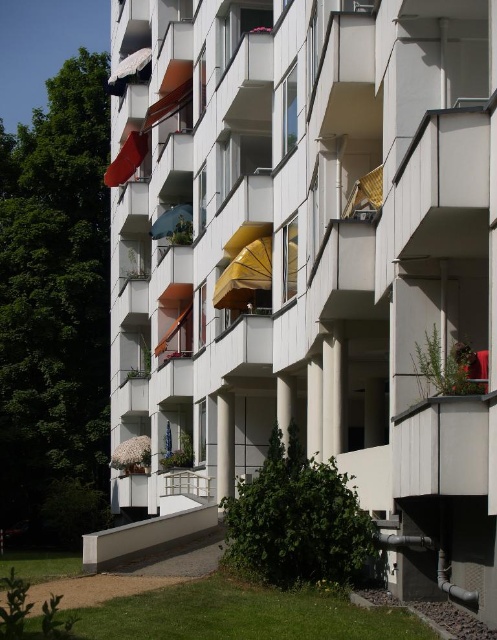
Where is `matte red umbrella at upper left`? The image size is (497, 640). matte red umbrella at upper left is located at coordinates (127, 160).

This screenshot has height=640, width=497. What are the coordinates of `matte red umbrella at upper left` in the screenshot? It's located at (127, 160).

The image size is (497, 640). In order to click on matte red umbrella at upper left in this screenshot , I will do `click(127, 160)`.

Between matte blue umbrella at center and blue fabric umbrella at center, which one is positioned lower?

blue fabric umbrella at center

Which is more to the left, matte blue umbrella at center or blue fabric umbrella at center?

From the viewer's perspective, blue fabric umbrella at center appears more on the left side.

In order to click on matte blue umbrella at center in this screenshot , I will do `click(170, 220)`.

Is matte red umbrella at upper left to the right of matte blue umbrella at center from the viewer's perspective?

No, matte red umbrella at upper left is not to the right of matte blue umbrella at center.

This screenshot has height=640, width=497. Describe the element at coordinates (127, 160) in the screenshot. I see `matte red umbrella at upper left` at that location.

Where is `matte red umbrella at upper left`? Image resolution: width=497 pixels, height=640 pixels. matte red umbrella at upper left is located at coordinates (127, 160).